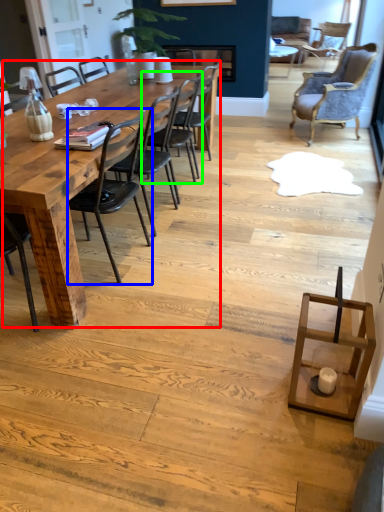
Question: Based on their relative distances, which object is farther from kitchen & dining room table (highlighted by a red box)? Choose from chair (highlighted by a blue box) and chair (highlighted by a green box).

Choices:
 (A) chair
 (B) chair

Answer: (B)